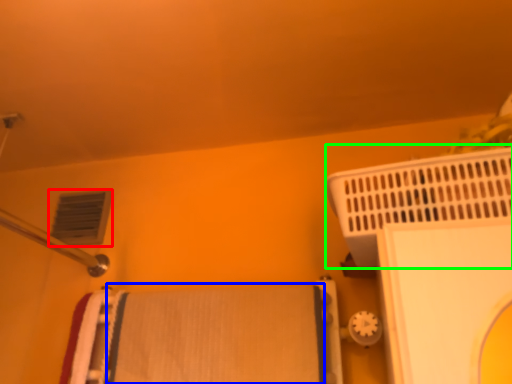
Question: Which object is positioned farthest from air conditioning (highlighted by a red box)? Select from bath towel (highlighted by a blue box) and bath heater (highlighted by a green box).

Choices:
 (A) bath towel
 (B) bath heater

Answer: (B)